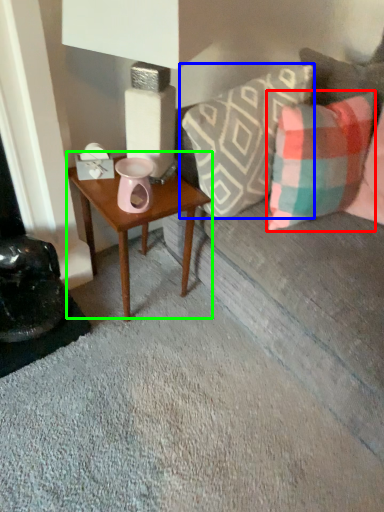
Question: Which object is positioned closest to pillow (highlighted by a red box)? Select from pillow (highlighted by a blue box) and table (highlighted by a green box).

Choices:
 (A) pillow
 (B) table

Answer: (A)